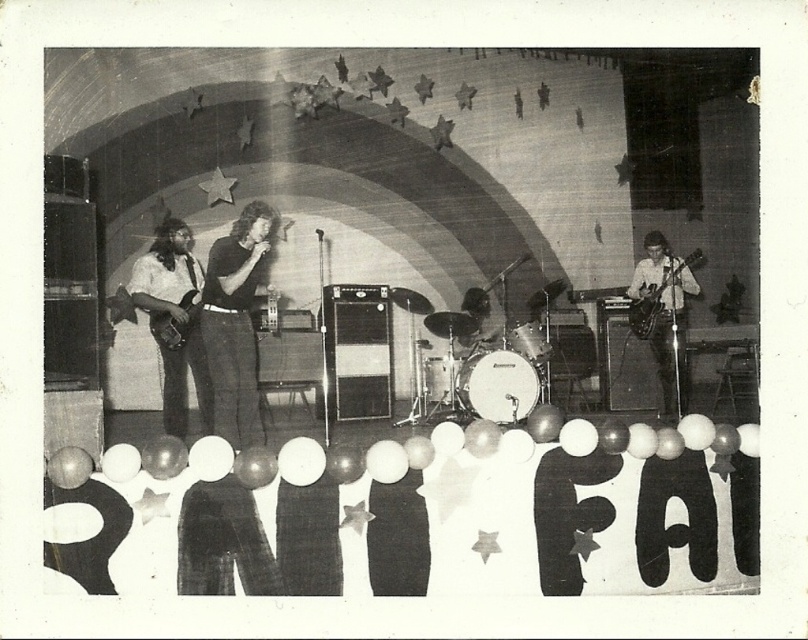
Question: Which object appears farthest from the camera in this image?

Choices:
 (A) shiny black electric guitar at left
 (B) smooth black shirt at center
 (C) smooth wood guitar at right
 (D) shiny black guitar at left

Answer: (C)

Question: Can you confirm if metallic silver electric guitar at right is thinner than shiny black electric guitar at left?

Choices:
 (A) yes
 (B) no

Answer: (A)

Question: Which point is closer to the camera?

Choices:
 (A) (181, 304)
 (B) (672, 340)
 (C) (659, 296)
 (D) (142, 275)

Answer: (A)

Question: Which object is the closest to the shiny black electric guitar at left?

Choices:
 (A) shiny black guitar at left
 (B) smooth black shirt at center
 (C) metallic silver electric guitar at right
 (D) smooth wood guitar at right

Answer: (A)

Question: Does shiny black guitar at left have a lesser width compared to metallic silver electric guitar at right?

Choices:
 (A) no
 (B) yes

Answer: (A)

Question: Is smooth black shirt at center bigger than smooth wood guitar at right?

Choices:
 (A) yes
 (B) no

Answer: (B)